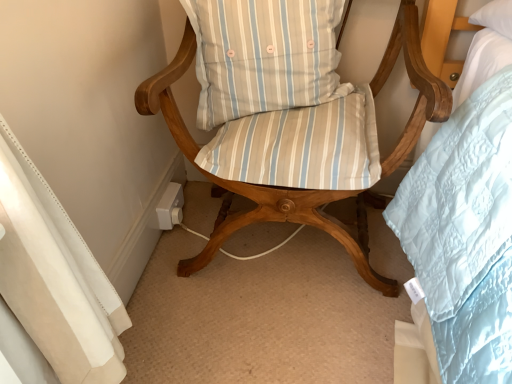
Question: In terms of width, does wooden chair with striped cushions at center look wider or thinner when compared to light blue striped cushion at center?

Choices:
 (A) wide
 (B) thin

Answer: (A)

Question: In the image, is wooden chair with striped cushions at center on the left side or the right side of light blue striped cushion at center?

Choices:
 (A) right
 (B) left

Answer: (A)

Question: From the image's perspective, is wooden chair with striped cushions at center located above or below light blue striped cushion at center?

Choices:
 (A) below
 (B) above

Answer: (A)

Question: Is light blue striped cushion at center in front of or behind wooden chair with striped cushions at center in the image?

Choices:
 (A) behind
 (B) front

Answer: (A)

Question: Considering the positions of light blue striped cushion at center and wooden chair with striped cushions at center in the image, is light blue striped cushion at center bigger or smaller than wooden chair with striped cushions at center?

Choices:
 (A) big
 (B) small

Answer: (B)

Question: Would you say light blue striped cushion at center is inside or outside wooden chair with striped cushions at center?

Choices:
 (A) inside
 (B) outside

Answer: (A)

Question: Is point (329, 4) positioned closer to the camera than point (239, 150)?

Choices:
 (A) farther
 (B) closer

Answer: (A)